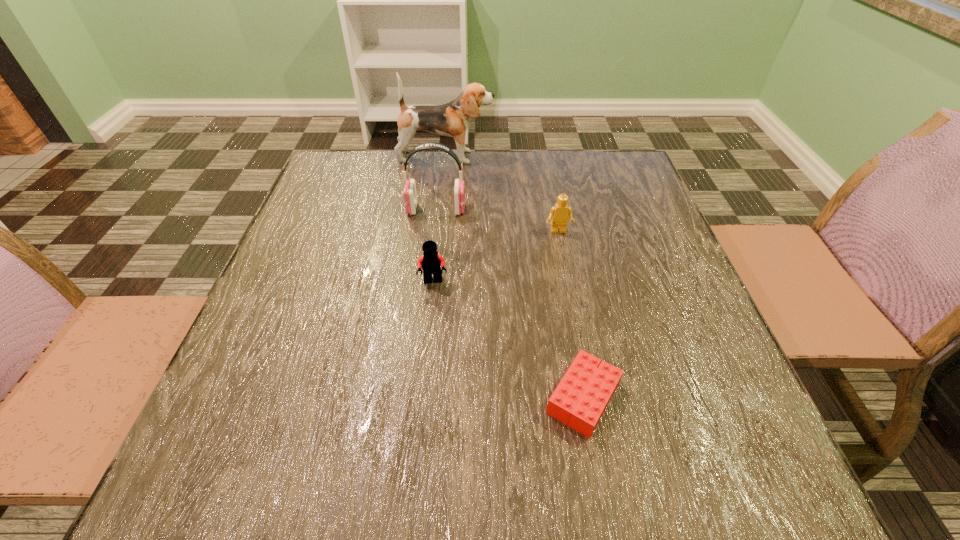
Find the location of `free point located on the outer surface of the second farthest object`. free point located on the outer surface of the second farthest object is located at coordinates (493, 210).

The image size is (960, 540). Identify the location of free location located 0.240m on the front-facing side of the second nearest object. (421, 394).

Locate an element on the screen. The image size is (960, 540). free region located 0.120m on the face of the third nearest object is located at coordinates (566, 273).

Find the location of `free point located on the left of the nearest Lego`. free point located on the left of the nearest Lego is located at coordinates (300, 398).

Locate an element on the screen. object present at the far edge is located at coordinates (452, 119).

The height and width of the screenshot is (540, 960). In the image, there is a desktop. Identify the location of blank space at the far edge. (430, 165).

Locate an element on the screen. blank space at the near edge of the desktop is located at coordinates (542, 478).

Find the location of `vacant space at the left edge`. vacant space at the left edge is located at coordinates (309, 321).

In the image, there is a desktop. In order to click on free space at the right edge in this screenshot , I will do `click(750, 404)`.

This screenshot has height=540, width=960. I want to click on free region at the far left corner of the desktop, so click(x=312, y=195).